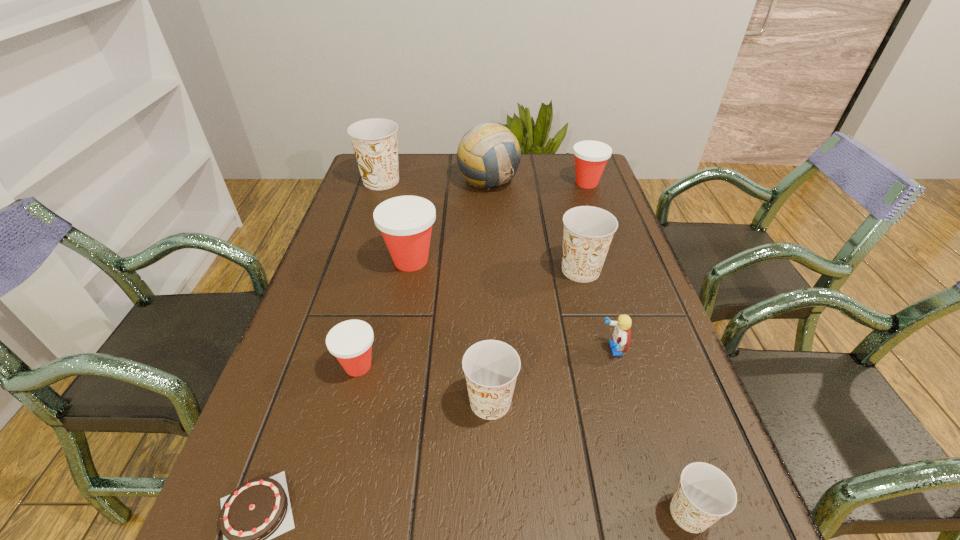
Image resolution: width=960 pixels, height=540 pixels. I want to click on volleyball, so click(x=488, y=156).

Where is `the tallest Dixie cup`? The height and width of the screenshot is (540, 960). the tallest Dixie cup is located at coordinates click(374, 141).

Where is `the leftmost orange Dixie cup`? The width and height of the screenshot is (960, 540). the leftmost orange Dixie cup is located at coordinates (374, 141).

Identify the location of the second biggest orange Dixie cup. (588, 231).

The image size is (960, 540). Find the location of `the second farthest red-orange Dixie cup`. the second farthest red-orange Dixie cup is located at coordinates (405, 222).

You are a GUI agent. You are given a task and a screenshot of the screen. Output one action in this format:
    pyautogui.click(x=<x>, y=<y>)
    Task: Click on the second smallest red-orange Dixie cup
    
    Given the screenshot: What is the action you would take?
    pyautogui.click(x=591, y=157)

In order to click on the rightmost red-orange Dixie cup in this screenshot , I will do `click(591, 157)`.

Find the location of a particular element. the third farthest orange Dixie cup is located at coordinates (491, 367).

Locate an element on the screen. the fourth Dixie cup from left to right is located at coordinates (491, 367).

Identify the location of Lego. This screenshot has width=960, height=540. (622, 333).